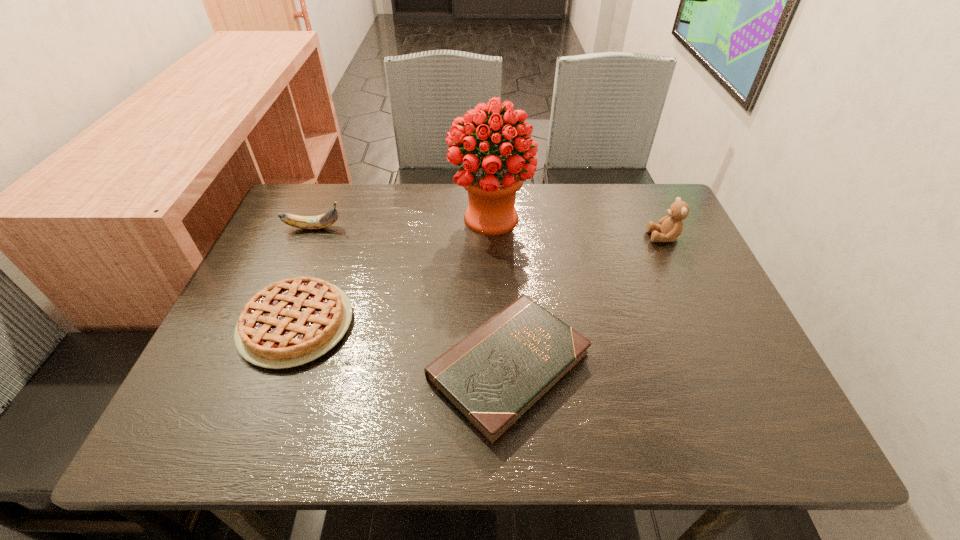
I want to click on vacant space located on the peel of the banana, so click(x=414, y=228).

At what (x,y) coordinates should I click in order to perform the action: click on vacant space located on the front of the pie. Please return your answer as a coordinate pair (x, y). This screenshot has height=540, width=960. Looking at the image, I should click on (268, 400).

I want to click on free space located 0.120m on the left of the Bible, so click(x=368, y=367).

The image size is (960, 540). I want to click on bouquet that is positioned at the far edge, so click(492, 178).

Where is `teddy bear that is positioned at the far edge`? teddy bear that is positioned at the far edge is located at coordinates (670, 227).

Find the location of a particular element. banana situated at the far edge is located at coordinates (321, 221).

Locate an element on the screen. Image resolution: width=960 pixels, height=540 pixels. object situated at the near edge is located at coordinates tap(493, 377).

Find the location of a particular element. The height and width of the screenshot is (540, 960). banana that is positioned at the left edge is located at coordinates (321, 221).

The width and height of the screenshot is (960, 540). What are the coordinates of `pie that is at the left edge` in the screenshot? It's located at (292, 322).

Find the location of a particular element. object at the right edge is located at coordinates (670, 227).